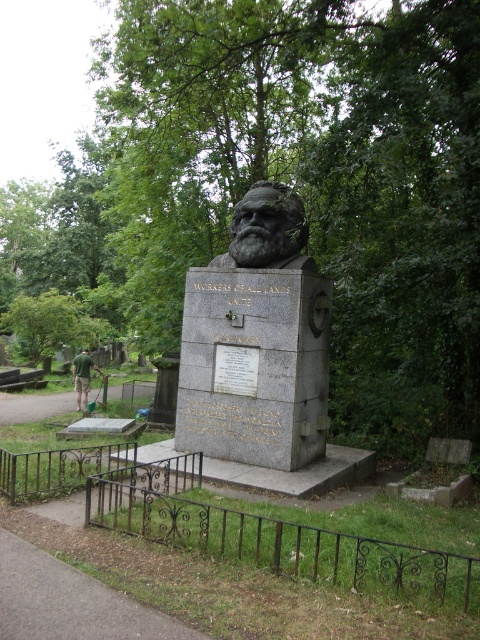
Does gray stone bust at center have a greater width compared to green stone bust at center?

Correct, the width of gray stone bust at center exceeds that of green stone bust at center.

Is gray stone bust at center to the left of green stone bust at center from the viewer's perspective?

Yes, gray stone bust at center is to the left of green stone bust at center.

Image resolution: width=480 pixels, height=640 pixels. I want to click on gray stone bust at center, so click(x=256, y=340).

What are the coordinates of `gray stone bust at center` in the screenshot? It's located at (256, 340).

Can you confirm if green leafy tree at upper center is positioned above green grass at lower left?

Yes.

Which is above, green leafy tree at upper center or green grass at lower left?

green leafy tree at upper center

At what (x,y) coordinates should I click in order to perform the action: click on green leafy tree at upper center. Please return your answer as a coordinate pair (x, y). Looking at the image, I should click on (289, 182).

Does green leafy tree at upper center have a smaller size compared to green stone bust at center?

Incorrect, green leafy tree at upper center is not smaller in size than green stone bust at center.

Is green leafy tree at upper center closer to the viewer compared to green stone bust at center?

Yes, it is.

Locate an element on the screen. green leafy tree at upper center is located at coordinates (289, 182).

You are a GUI agent. You are given a task and a screenshot of the screen. Output one action in this format:
    pyautogui.click(x=<x>, y=<y>)
    Task: Click on the green leafy tree at upper center
    Image resolution: width=480 pixels, height=640 pixels.
    Given the screenshot: What is the action you would take?
    pyautogui.click(x=289, y=182)